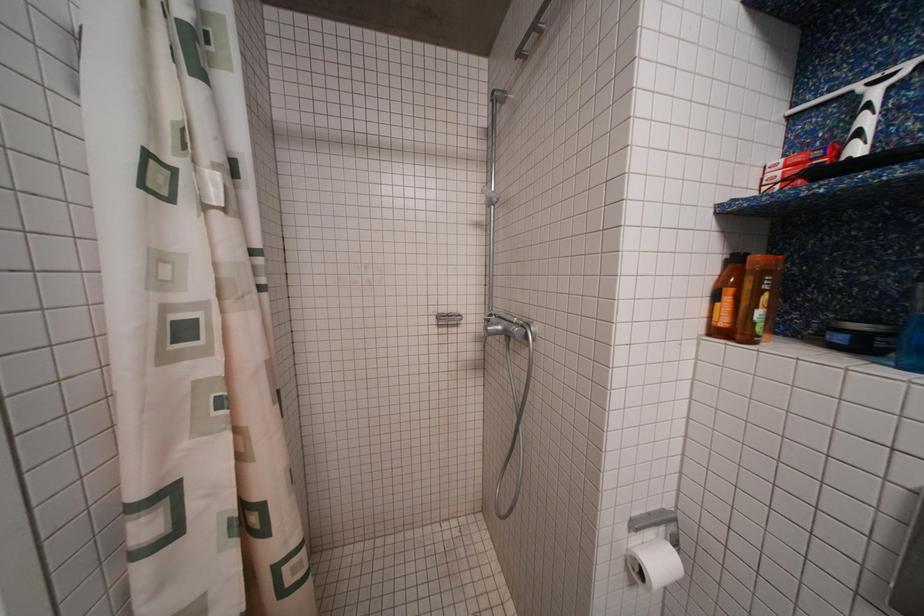
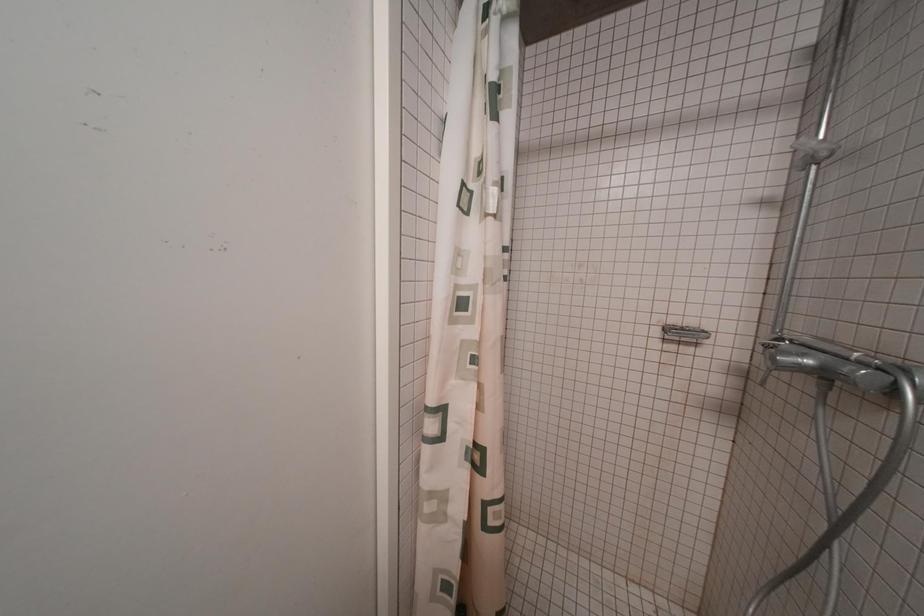
Question: How did the camera likely rotate?

Choices:
 (A) Left
 (B) Right
 (C) Up
 (D) Down

Answer: (A)